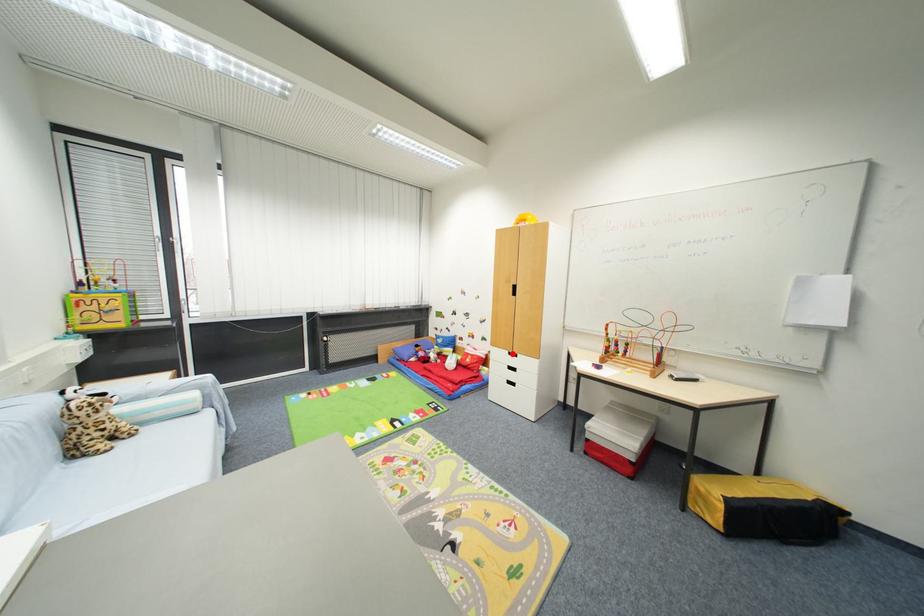
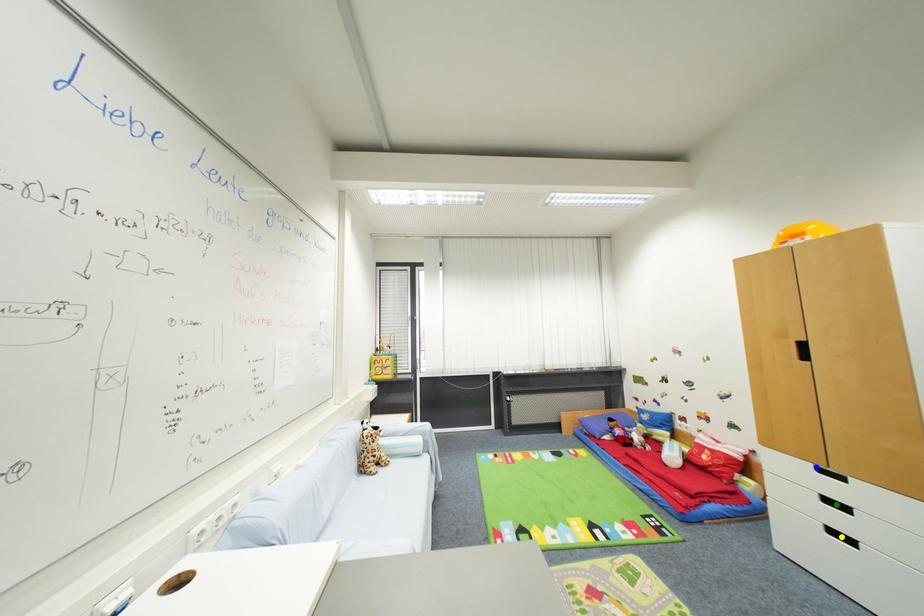
Question: I am providing you with two images of the same scene from different viewpoints. A red point is marked on the first image. You are given multiple points on the second image. Which mark in image 2 goes with the point in image 1?

Choices:
 (A) blue point
 (B) yellow point
 (C) green point

Answer: (A)